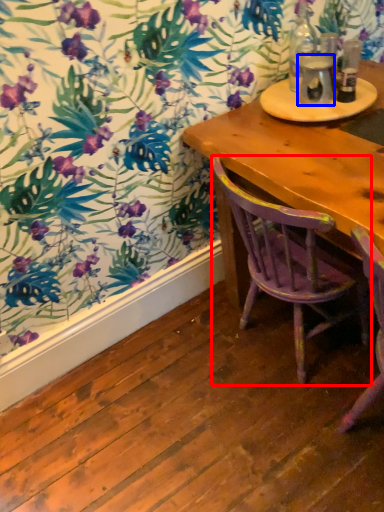
Question: Which of the following is the farthest to the observer, chair (highlighted by a red box) or beverage (highlighted by a blue box)?

Choices:
 (A) chair
 (B) beverage

Answer: (B)